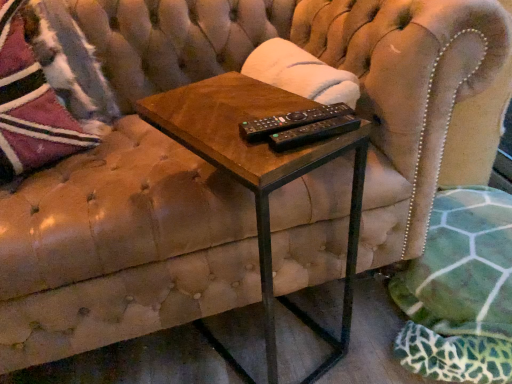
This screenshot has height=384, width=512. In order to click on vacant space behind black plastic remote controls at center in this screenshot , I will do `click(260, 97)`.